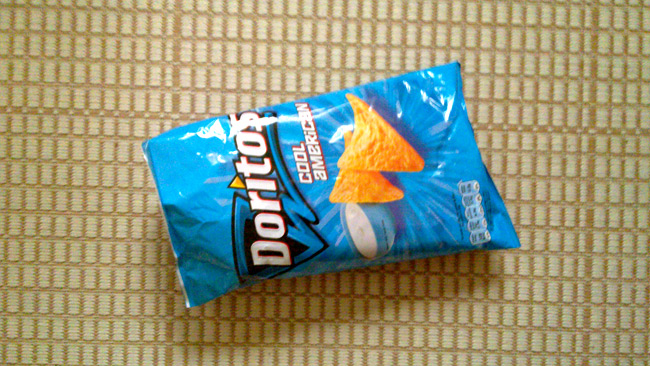
Identify the location of blue bowl. (379, 223).